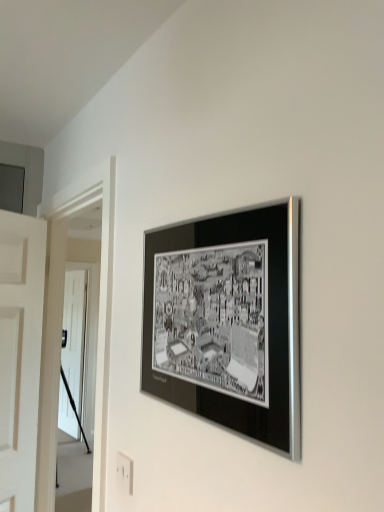
Question: Which direction should I rotate to look at white plastic electric outlet at lower center?

Choices:
 (A) left
 (B) right

Answer: (A)

Question: Is white glossy door at left in contact with black metallic frame at upper center?

Choices:
 (A) no
 (B) yes

Answer: (A)

Question: From a real-world perspective, is white glossy door at left located higher than black metallic frame at upper center?

Choices:
 (A) yes
 (B) no

Answer: (B)

Question: Can you confirm if white glossy door at left is thinner than black metallic frame at upper center?

Choices:
 (A) no
 (B) yes

Answer: (B)

Question: Considering the relative positions of white glossy door at left and black metallic frame at upper center in the image provided, is white glossy door at left to the right of black metallic frame at upper center from the viewer's perspective?

Choices:
 (A) yes
 (B) no

Answer: (B)

Question: Can you confirm if white glossy door at left is bigger than black metallic frame at upper center?

Choices:
 (A) no
 (B) yes

Answer: (B)

Question: Could you tell me if white glossy door at left is facing black metallic frame at upper center?

Choices:
 (A) no
 (B) yes

Answer: (A)

Question: Does black metallic frame at upper center have a lesser width compared to white glossy door at left?

Choices:
 (A) yes
 (B) no

Answer: (B)

Question: Is black metallic frame at upper center to the left of white glossy door at left from the viewer's perspective?

Choices:
 (A) no
 (B) yes

Answer: (A)

Question: Is black metallic frame at upper center at the right side of white glossy door at left?

Choices:
 (A) yes
 (B) no

Answer: (A)

Question: From the image's perspective, does black metallic frame at upper center appear lower than white glossy door at left?

Choices:
 (A) no
 (B) yes

Answer: (A)

Question: Is black metallic frame at upper center taller than white glossy door at left?

Choices:
 (A) no
 (B) yes

Answer: (A)

Question: From the image's perspective, would you say black metallic frame at upper center is positioned over white glossy door at left?

Choices:
 (A) yes
 (B) no

Answer: (A)

Question: Does white plastic electric outlet at lower center have a lesser width compared to black metallic frame at upper center?

Choices:
 (A) no
 (B) yes

Answer: (B)